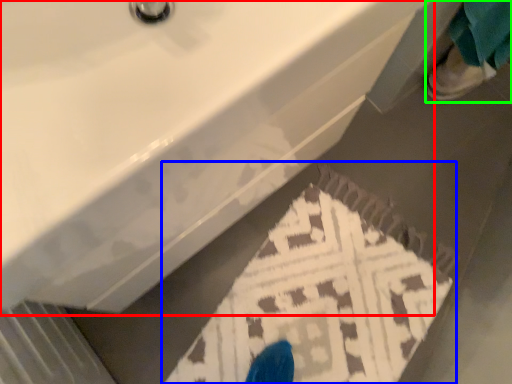
Question: Estimate the real-world distances between objects in this image. Which object is closer to sink (highlighted by a red box), doormat (highlighted by a blue box) or person (highlighted by a green box)?

Choices:
 (A) doormat
 (B) person

Answer: (A)